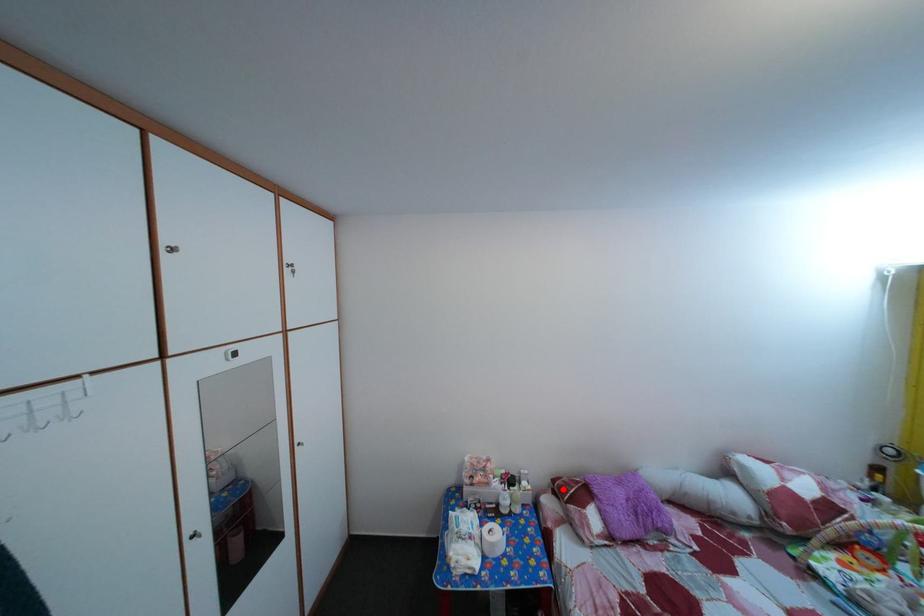
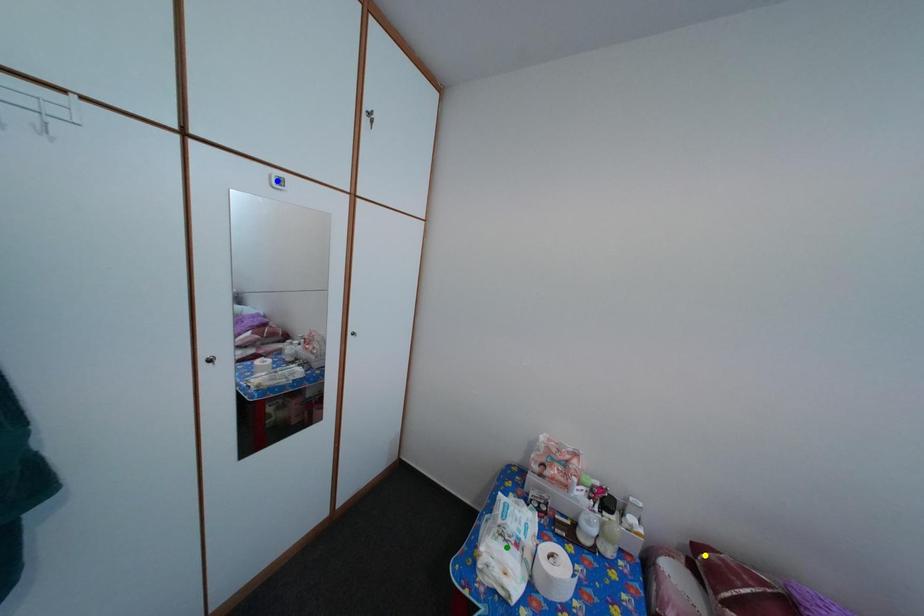
Question: I am providing you with two images of the same scene from different viewpoints. A red point is marked on the first image. You are given multiple points on the second image. Which point in image 2 represents the same 3d spot as the red point in image 1?

Choices:
 (A) green point
 (B) blue point
 (C) yellow point

Answer: (C)